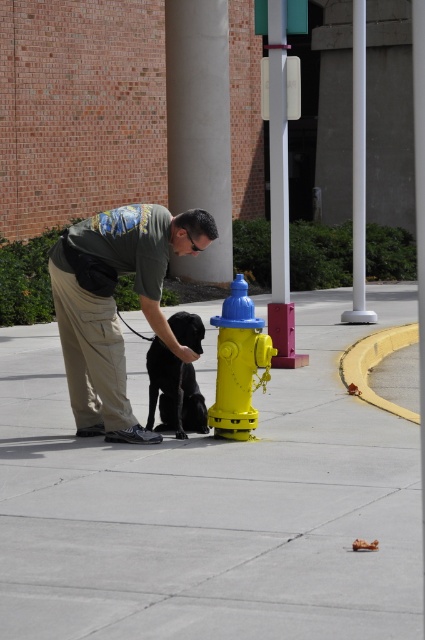
You are standing at the point marked by the coordinates point [115,305] in the image. What object is located exactly at that point?

The point [115,305] corresponds to khaki cargo pants at center.

You are a delivery robot navigating a parking lot. You need to place a package on the smooth concrete sidewalk at center. However, there is a shiny black dog at center in your way. Can you place the package on the sidewalk without moving the dog?

The smooth concrete sidewalk at center is below the shiny black dog at center, so the dog is on the sidewalk. Therefore, you cannot place the package there without moving the dog.

You are a delivery robot with a 1.20 meter wide package. You need to move from the smooth concrete sidewalk at center to the shiny black dog at center. Can you fit through the space between them?

The smooth concrete sidewalk at center is 1.30 meters from the shiny black dog at center. Since your package is 1.20 meters wide, you can fit through the space between them as the distance is slightly larger than the package width.